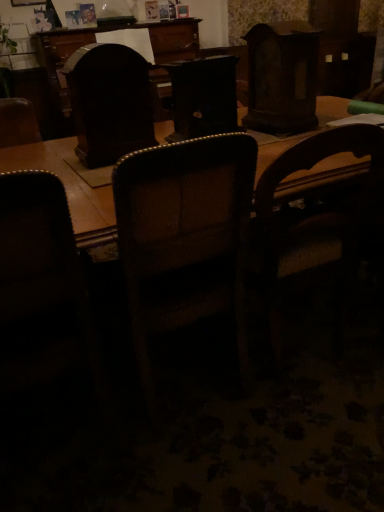
Question: Does dark brown leather chair at left, the first chair when ordered from left to right, touch brown leather chair at center, arranged as the 2th chair when viewed from the right?

Choices:
 (A) yes
 (B) no

Answer: (B)

Question: Is dark brown leather chair at left, the third chair from the right, not within brown leather chair at center, arranged as the 2th chair when viewed from the right?

Choices:
 (A) no
 (B) yes

Answer: (B)

Question: Is dark brown leather chair at left, the third chair from the right, behind brown leather chair at center, arranged as the 2th chair when viewed from the right?

Choices:
 (A) no
 (B) yes

Answer: (A)

Question: From a real-world perspective, is dark brown leather chair at left, the first chair when ordered from left to right, over brown leather chair at center, the 2th chair in the left-to-right sequence?

Choices:
 (A) no
 (B) yes

Answer: (A)

Question: Is brown leather chair at center, arranged as the 2th chair when viewed from the right, located within dark brown leather chair at left, the first chair when ordered from left to right?

Choices:
 (A) yes
 (B) no

Answer: (B)

Question: Is point (278, 359) closer or farther from the camera than point (31, 313)?

Choices:
 (A) closer
 (B) farther

Answer: (B)

Question: From a real-world perspective, relative to dark brown leather chair at left, the third chair from the right, is wooden chair at center, which is counted as the 3th chair, starting from the left, vertically above or below?

Choices:
 (A) below
 (B) above

Answer: (A)

Question: Considering their positions, is wooden chair at center, which appears as the 1th chair when viewed from the right, located in front of or behind dark brown leather chair at left, the first chair when ordered from left to right?

Choices:
 (A) front
 (B) behind

Answer: (B)

Question: In the image, is wooden chair at center, which appears as the 1th chair when viewed from the right, on the left side or the right side of dark brown leather chair at left, the third chair from the right?

Choices:
 (A) right
 (B) left

Answer: (A)

Question: In terms of height, does brown leather chair at center, the 2th chair in the left-to-right sequence, look taller or shorter compared to dark wood swivel chair at center?

Choices:
 (A) short
 (B) tall

Answer: (B)

Question: From the image's perspective, is brown leather chair at center, arranged as the 2th chair when viewed from the right, above or below dark wood swivel chair at center?

Choices:
 (A) above
 (B) below

Answer: (B)

Question: In the image, is brown leather chair at center, the 2th chair in the left-to-right sequence, positioned in front of or behind dark wood swivel chair at center?

Choices:
 (A) behind
 (B) front

Answer: (B)

Question: Would you say brown leather chair at center, arranged as the 2th chair when viewed from the right, is inside or outside dark wood swivel chair at center?

Choices:
 (A) inside
 (B) outside

Answer: (B)

Question: In terms of width, does dark brown leather chair at left, the third chair from the right, look wider or thinner when compared to dark wood swivel chair at center?

Choices:
 (A) thin
 (B) wide

Answer: (B)

Question: Considering the positions of point (69, 316) and point (122, 92), is point (69, 316) closer or farther from the camera than point (122, 92)?

Choices:
 (A) farther
 (B) closer

Answer: (B)